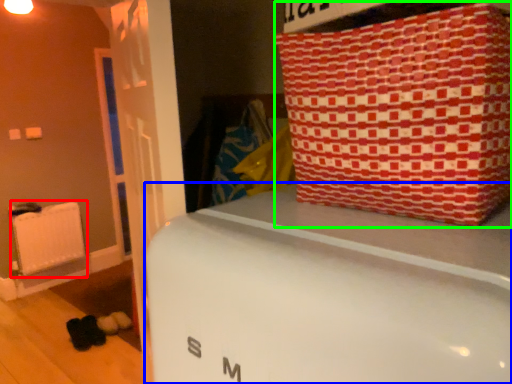
Question: Based on their relative distances, which object is farther from radiator (highlighted by a red box)? Choose from furniture (highlighted by a blue box) and package (highlighted by a green box).

Choices:
 (A) furniture
 (B) package

Answer: (B)